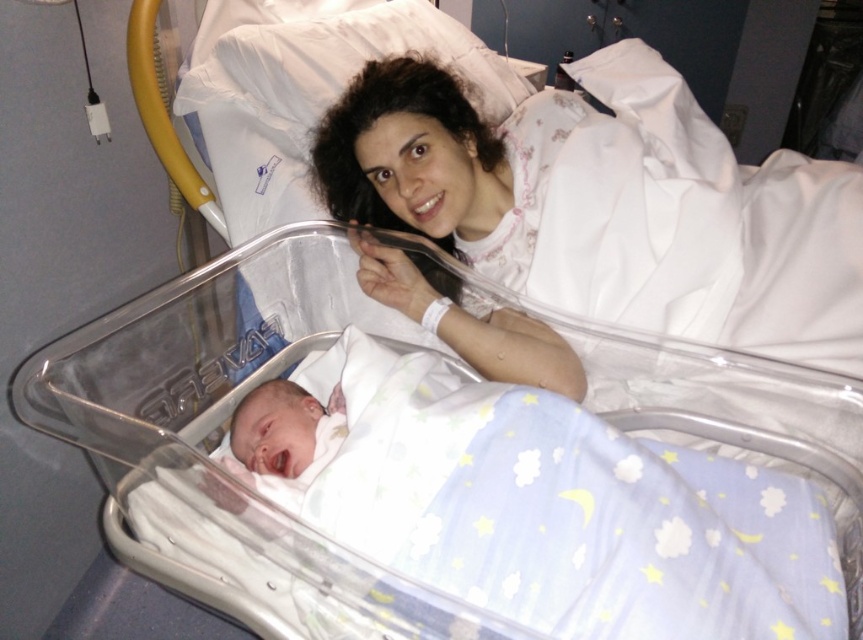
In the scene shown: Is white satin gown at upper center positioned behind soft white swaddle at center?

Yes, it is behind soft white swaddle at center.

Find the location of a particular element. Image resolution: width=863 pixels, height=640 pixels. white satin gown at upper center is located at coordinates (609, 204).

You are a GUI agent. You are given a task and a screenshot of the screen. Output one action in this format:
    pyautogui.click(x=<x>, y=<y>)
    Task: Click on the white satin gown at upper center
    
    Given the screenshot: What is the action you would take?
    pyautogui.click(x=609, y=204)